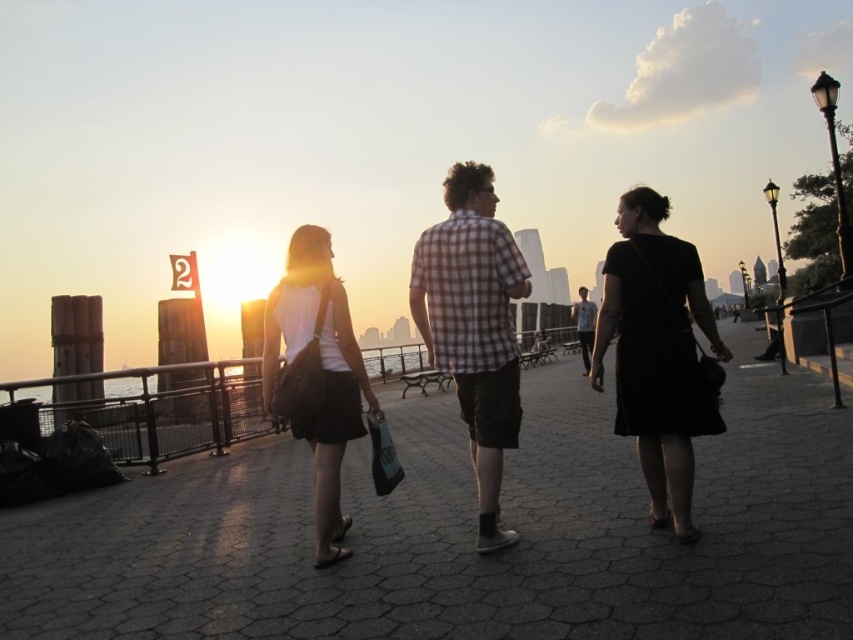
Question: Which point appears closest to the camera in this image?

Choices:
 (A) (367, 396)
 (B) (448, 259)
 (C) (444, 368)
 (D) (576, 332)

Answer: (B)

Question: Which point is closer to the camera?

Choices:
 (A) light blue plaid shirt at center
 (B) checkered fabric shirt at center

Answer: (B)

Question: Which is nearer to the matte black bag at center?

Choices:
 (A) black matte dress at center
 (B) light blue plaid shirt at center

Answer: (A)

Question: Is checkered fabric shirt at center thinner than matte black bag at center?

Choices:
 (A) no
 (B) yes

Answer: (A)

Question: Can you confirm if matte plaid shirt at center is positioned above checkered fabric shirt at center?

Choices:
 (A) yes
 (B) no

Answer: (B)

Question: Can you confirm if matte plaid shirt at center is bigger than checkered fabric shirt at center?

Choices:
 (A) yes
 (B) no

Answer: (B)